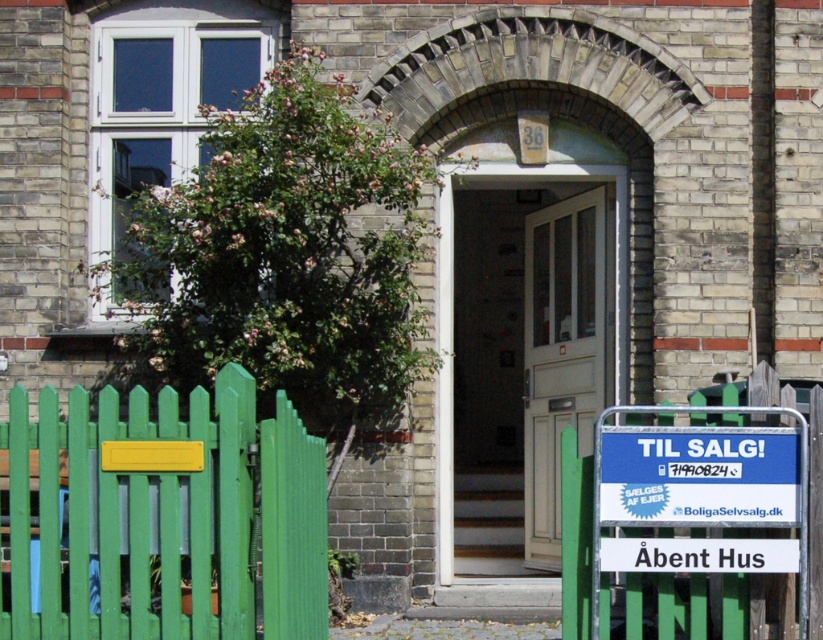
You are standing at the base of the steps leading to the entrance of the residential building. You see the white glass door at center and the white wooden door at center. Which door is closer to you?

The white glass door at center is closer to you since it is further to the viewer than the white wooden door at center, meaning it is positioned in front of the wooden door.